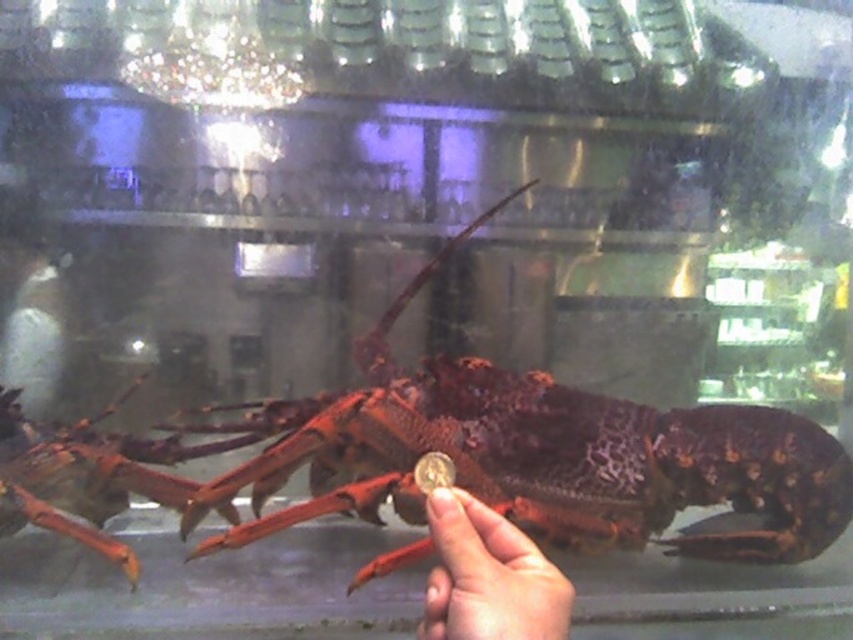
Between smooth skin hand at center and shiny metallic claw at center, which one appears on the right side from the viewer's perspective?

From the viewer's perspective, smooth skin hand at center appears more on the right side.

Is smooth skin hand at center above shiny metallic claw at center?

Incorrect, smooth skin hand at center is not positioned above shiny metallic claw at center.

Identify the location of smooth skin hand at center. Image resolution: width=853 pixels, height=640 pixels. (488, 577).

The width and height of the screenshot is (853, 640). I want to click on smooth skin hand at center, so [x=488, y=577].

Does point (386, 554) lie in front of point (427, 474)?

No, it is behind (427, 474).

Locate an element on the screen. The image size is (853, 640). shiny brown lobster at center is located at coordinates (537, 454).

Which is more to the left, shiny brown lobster at center or smooth skin hand at center?

From the viewer's perspective, smooth skin hand at center appears more on the left side.

Which is in front, point (776, 438) or point (561, 577)?

Point (561, 577)

Which is in front, point (819, 529) or point (457, 531)?

Point (457, 531) is more forward.

I want to click on shiny brown lobster at center, so [x=537, y=454].